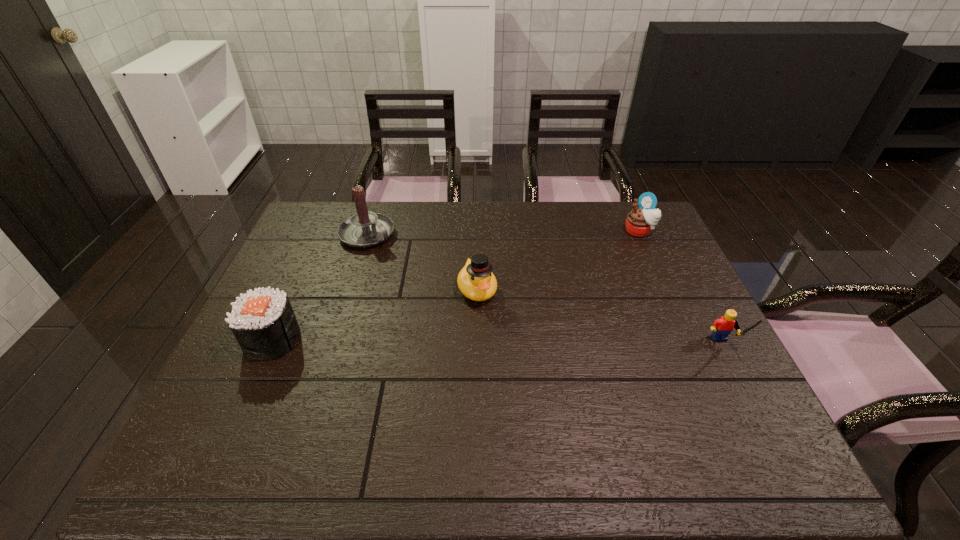
Locate an element on the screen. The width and height of the screenshot is (960, 540). sushi is located at coordinates (263, 322).

In order to click on Lego in this screenshot , I will do `click(722, 327)`.

Identify the location of muffin. (640, 221).

You are a GUI agent. You are given a task and a screenshot of the screen. Output one action in this format:
    pyautogui.click(x=<x>, y=<y>)
    Task: Click on the third object from right to left
    This screenshot has height=540, width=960.
    Given the screenshot: What is the action you would take?
    pyautogui.click(x=476, y=281)

At what (x,y) coordinates should I click in order to perform the action: click on duck. Please return your answer as a coordinate pair (x, y). The height and width of the screenshot is (540, 960). Looking at the image, I should click on (476, 281).

In order to click on the tallest object in this screenshot , I will do `click(364, 229)`.

Locate an element on the screen. The image size is (960, 540). vacant region located 0.070m on the front of the sushi is located at coordinates tap(252, 386).

Identify the location of vacant space located on the front-facing side of the Lego. The image size is (960, 540). (755, 406).

Where is `vacant space located on the front-facing side of the muffin`? This screenshot has height=540, width=960. vacant space located on the front-facing side of the muffin is located at coordinates (624, 246).

Find the location of a particular element. The image size is (960, 540). free location located on the front-facing side of the muffin is located at coordinates (580, 291).